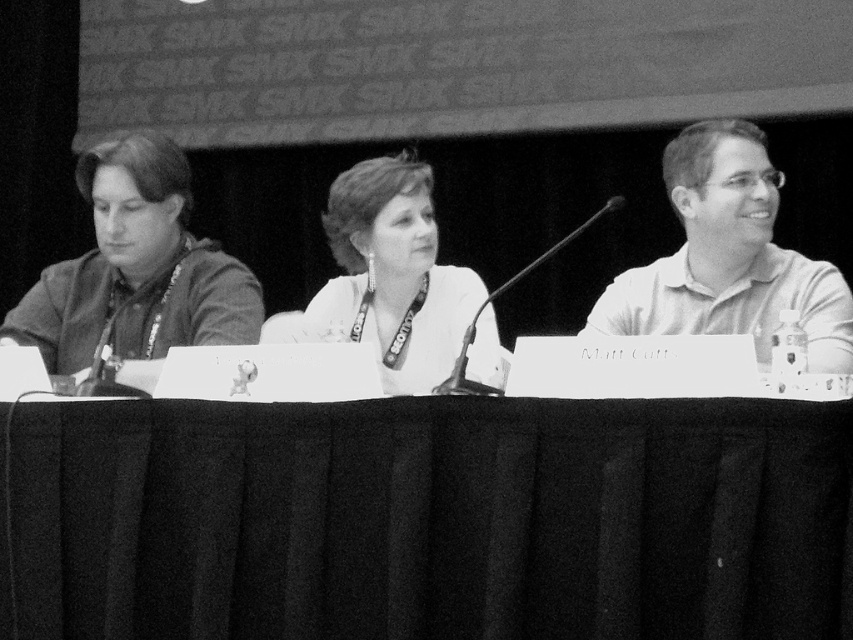
Question: Which object is the closest to the white matte/soft fabric at center?

Choices:
 (A) matte white shirt at center
 (B) white cotton polo shirt at right
 (C) black fabric table at center

Answer: (A)

Question: Does black fabric table at center have a smaller size compared to white cotton polo shirt at right?

Choices:
 (A) yes
 (B) no

Answer: (B)

Question: Which of the following is the closest to the observer?

Choices:
 (A) (437, 323)
 (B) (1, 541)
 (C) (189, 262)

Answer: (B)

Question: Considering the relative positions of white cotton polo shirt at right and white matte/soft fabric at center in the image provided, where is white cotton polo shirt at right located with respect to white matte/soft fabric at center?

Choices:
 (A) left
 (B) right

Answer: (B)

Question: Can you confirm if white cotton polo shirt at right is positioned below white matte/soft fabric at center?

Choices:
 (A) yes
 (B) no

Answer: (B)

Question: Which point is farther to the camera?

Choices:
 (A) matte white shirt at center
 (B) white matte/soft fabric at center
 (C) white cotton polo shirt at right

Answer: (A)